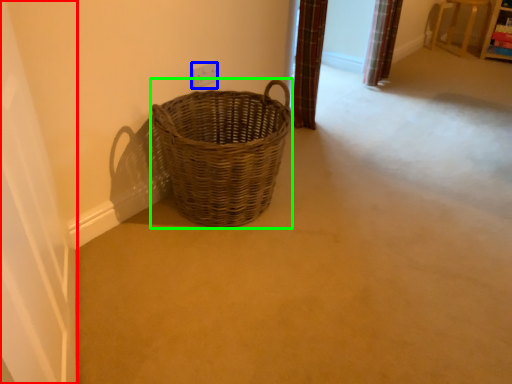
Question: Which is farther away from screen door (highlighted by a red box)? electric outlet (highlighted by a blue box) or picnic basket (highlighted by a green box)?

Choices:
 (A) electric outlet
 (B) picnic basket

Answer: (A)